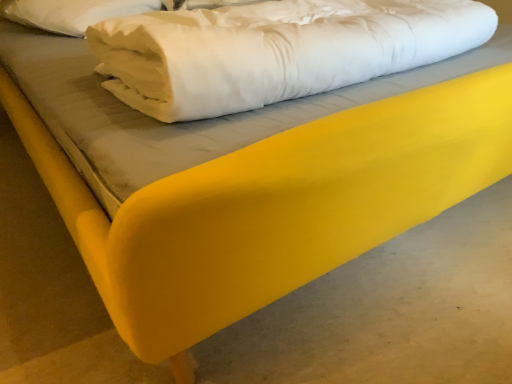
The height and width of the screenshot is (384, 512). I want to click on white soft pillow at upper left, so click(x=71, y=13).

Describe the element at coordinates (71, 13) in the screenshot. I see `white soft pillow at upper left` at that location.

What is the approximate width of white soft fabric at center?

white soft fabric at center is 23.97 inches in width.

Where is `white soft fabric at center`? This screenshot has width=512, height=384. white soft fabric at center is located at coordinates (275, 50).

The height and width of the screenshot is (384, 512). What do you see at coordinates (275, 50) in the screenshot?
I see `white soft fabric at center` at bounding box center [275, 50].

Where is `white soft pillow at upper left`? This screenshot has width=512, height=384. white soft pillow at upper left is located at coordinates (71, 13).

Which is more to the right, white soft fabric at center or white soft pillow at upper left?

Positioned to the right is white soft fabric at center.

Is white soft fabric at center behind white soft pillow at upper left?

No, white soft fabric at center is in front of white soft pillow at upper left.

Is point (445, 25) closer to viewer compared to point (20, 6)?

Yes, it is in front of point (20, 6).

From the image's perspective, is white soft fabric at center on top of white soft pillow at upper left?

Incorrect, from the image's perspective, white soft fabric at center is lower than white soft pillow at upper left.

From a real-world perspective, who is located lower, white soft fabric at center or white soft pillow at upper left?

In real-world perspective, white soft pillow at upper left is lower.

Is white soft fabric at center wider than white soft pillow at upper left?

Correct, the width of white soft fabric at center exceeds that of white soft pillow at upper left.

Considering the sizes of white soft fabric at center and white soft pillow at upper left in the image, is white soft fabric at center taller or shorter than white soft pillow at upper left?

Considering their sizes, white soft fabric at center has more height than white soft pillow at upper left.

Based on their sizes in the image, would you say white soft fabric at center is bigger or smaller than white soft pillow at upper left?

Clearly, white soft fabric at center is larger in size than white soft pillow at upper left.

Is white soft fabric at center spatially inside white soft pillow at upper left, or outside of it?

white soft fabric at center lies outside white soft pillow at upper left.

Is there a large distance between white soft fabric at center and white soft pillow at upper left?

No.

Could you tell me if white soft fabric at center is turned towards white soft pillow at upper left?

No, white soft fabric at center is not turned towards white soft pillow at upper left.

Measure the distance between white soft fabric at center and white soft pillow at upper left.

white soft fabric at center is 31.45 inches from white soft pillow at upper left.

At what (x,y) coordinates should I click in order to perform the action: click on pillow on the left of white soft fabric at center. Please return your answer as a coordinate pair (x, y). Image resolution: width=512 pixels, height=384 pixels. Looking at the image, I should click on (x=71, y=13).

Between white soft pillow at upper left and white soft fabric at center, which one appears on the right side from the viewer's perspective?

white soft fabric at center is more to the right.

In the image, is white soft pillow at upper left positioned in front of or behind white soft fabric at center?

Clearly, white soft pillow at upper left is behind white soft fabric at center.

Considering the points (27, 23) and (461, 47), which point is behind, point (27, 23) or point (461, 47)?

Point (27, 23)

From the image's perspective, is white soft pillow at upper left above or below white soft fabric at center?

white soft pillow at upper left is above white soft fabric at center.

From a real-world perspective, which object rests below the other?

In real-world perspective, white soft pillow at upper left is lower.

Considering the sizes of objects white soft pillow at upper left and white soft fabric at center in the image provided, who is thinner, white soft pillow at upper left or white soft fabric at center?

white soft pillow at upper left is thinner.

Considering the sizes of objects white soft pillow at upper left and white soft fabric at center in the image provided, who is shorter, white soft pillow at upper left or white soft fabric at center?

With less height is white soft pillow at upper left.

Who is bigger, white soft pillow at upper left or white soft fabric at center?

With larger size is white soft fabric at center.

Consider the image. Is white soft pillow at upper left inside the boundaries of white soft fabric at center, or outside?

white soft pillow at upper left is located beyond the bounds of white soft fabric at center.

Are white soft pillow at upper left and white soft fabric at center located far from each other?

No, there isn't a large distance between white soft pillow at upper left and white soft fabric at center.

Does white soft pillow at upper left turn towards white soft fabric at center?

Yes, white soft pillow at upper left faces towards white soft fabric at center.

What's the angular difference between white soft pillow at upper left and white soft fabric at center's facing directions?

34.1 degrees.

How far apart are white soft pillow at upper left and white soft fabric at center?

31.45 inches.

Find the location of a particular element. The width and height of the screenshot is (512, 384). pillow to the left of white soft fabric at center is located at coordinates (71, 13).

Identify the location of sheet in front of the white soft pillow at upper left. This screenshot has width=512, height=384. (275, 50).

The width and height of the screenshot is (512, 384). In order to click on pillow to the left of white soft fabric at center in this screenshot , I will do `click(71, 13)`.